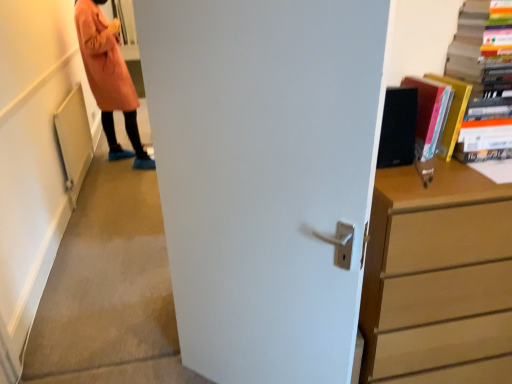
How much space does hardcover book at upper right, placed as the second book when sorted from left to right, occupy horizontally?

hardcover book at upper right, placed as the second book when sorted from left to right, is 29.87 centimeters wide.

The height and width of the screenshot is (384, 512). I want to click on wooden chest of drawers at right, so click(436, 271).

The image size is (512, 384). Describe the element at coordinates (452, 112) in the screenshot. I see `matte black book at upper right, placed as the second book when sorted from right to left` at that location.

This screenshot has width=512, height=384. Identify the location of hardcover book at upper right, placed as the second book when sorted from left to right. (440, 48).

Can you confirm if white matte door at center is positioned to the right of matte black book at upper right, placed as the second book when sorted from right to left?

In fact, white matte door at center is to the left of matte black book at upper right, placed as the second book when sorted from right to left.

Where is `the 1st book above when counting from the white matte door at center (from the image's perspective)`? The height and width of the screenshot is (384, 512). the 1st book above when counting from the white matte door at center (from the image's perspective) is located at coordinates (452, 112).

From a real-world perspective, is white matte door at center physically below matte black book at upper right, which is counted as the first book, starting from the left?

Result: Indeed, from a real-world perspective, white matte door at center is positioned beneath matte black book at upper right, which is counted as the first book, starting from the left.

From a real-world perspective, is hardcover book at upper right, which appears as the 1th book when viewed from the right, below white matte door at center?

No, from a real-world perspective, hardcover book at upper right, which appears as the 1th book when viewed from the right, is not beneath white matte door at center.

Locate an element on the screen. This screenshot has height=384, width=512. door on the left of hardcover book at upper right, placed as the second book when sorted from left to right is located at coordinates (265, 177).

Considering the sizes of objects hardcover book at upper right, placed as the second book when sorted from left to right, and white matte door at center in the image provided, who is smaller, hardcover book at upper right, placed as the second book when sorted from left to right, or white matte door at center?

hardcover book at upper right, placed as the second book when sorted from left to right, is smaller.

Is hardcover book at upper right, which appears as the 1th book when viewed from the right, located outside white matte door at center?

Absolutely, hardcover book at upper right, which appears as the 1th book when viewed from the right, is external to white matte door at center.

Can you confirm if matte black book at upper right, which is counted as the first book, starting from the left, is thinner than white matte door at center?

In fact, matte black book at upper right, which is counted as the first book, starting from the left, might be wider than white matte door at center.

Between point (460, 97) and point (251, 231), which one is positioned behind?

The point (460, 97) is farther from the camera.

From a real-world perspective, starting from the white matte door at center, which book is the 1st one vertically above it? Please provide its 2D coordinates.

[(452, 112)]

Looking at this image, would you say matte black book at upper right, which is counted as the first book, starting from the left, is inside or outside white matte door at center?

matte black book at upper right, which is counted as the first book, starting from the left, lies outside white matte door at center.

Do you think wooden chest of drawers at right is within hardcover book at upper right, placed as the second book when sorted from left to right, or outside of it?

wooden chest of drawers at right lies outside hardcover book at upper right, placed as the second book when sorted from left to right.

From the image's perspective, is wooden chest of drawers at right located above hardcover book at upper right, which appears as the 1th book when viewed from the right?

No, from the image's perspective, wooden chest of drawers at right is not on top of hardcover book at upper right, which appears as the 1th book when viewed from the right.

Considering the relative sizes of wooden chest of drawers at right and hardcover book at upper right, placed as the second book when sorted from left to right, in the image provided, is wooden chest of drawers at right bigger than hardcover book at upper right, placed as the second book when sorted from left to right,?

Correct, wooden chest of drawers at right is larger in size than hardcover book at upper right, placed as the second book when sorted from left to right.

Is wooden chest of drawers at right at the left side of hardcover book at upper right, placed as the second book when sorted from left to right?

Yes, wooden chest of drawers at right is to the left of hardcover book at upper right, placed as the second book when sorted from left to right.

Considering the positions of objects hardcover book at upper right, placed as the second book when sorted from left to right, and wooden chest of drawers at right in the image provided, who is more to the right, hardcover book at upper right, placed as the second book when sorted from left to right, or wooden chest of drawers at right?

From the viewer's perspective, hardcover book at upper right, placed as the second book when sorted from left to right, appears more on the right side.

From a real-world perspective, is hardcover book at upper right, placed as the second book when sorted from left to right, above or below wooden chest of drawers at right?

hardcover book at upper right, placed as the second book when sorted from left to right, is situated higher than wooden chest of drawers at right in the real world.

Is hardcover book at upper right, placed as the second book when sorted from left to right, not near wooden chest of drawers at right?

hardcover book at upper right, placed as the second book when sorted from left to right, is actually quite close to wooden chest of drawers at right.

From the image's perspective, which object appears higher, white matte door at center or hardcover book at upper right, placed as the second book when sorted from left to right?

From the image's view, hardcover book at upper right, placed as the second book when sorted from left to right, is above.

From the picture: Considering the sizes of objects white matte door at center and hardcover book at upper right, which appears as the 1th book when viewed from the right, in the image provided, who is wider, white matte door at center or hardcover book at upper right, which appears as the 1th book when viewed from the right,?

hardcover book at upper right, which appears as the 1th book when viewed from the right.

Can you confirm if white matte door at center is taller than hardcover book at upper right, which appears as the 1th book when viewed from the right?

Yes, white matte door at center is taller than hardcover book at upper right, which appears as the 1th book when viewed from the right.

Between white matte door at center and hardcover book at upper right, which appears as the 1th book when viewed from the right, which one is positioned in front?

white matte door at center.

Are matte black book at upper right, which is counted as the first book, starting from the left, and hardcover book at upper right, placed as the second book when sorted from left to right, far apart?

No, matte black book at upper right, which is counted as the first book, starting from the left, is in close proximity to hardcover book at upper right, placed as the second book when sorted from left to right.

Does matte black book at upper right, placed as the second book when sorted from right to left, have a lesser width compared to hardcover book at upper right, placed as the second book when sorted from left to right?

Yes, matte black book at upper right, placed as the second book when sorted from right to left, is thinner than hardcover book at upper right, placed as the second book when sorted from left to right.

Identify the location of book above the matte black book at upper right, which is counted as the first book, starting from the left (from a real-world perspective). Image resolution: width=512 pixels, height=384 pixels. (440, 48).

Find the location of `the 1st book above the white matte door at center (from the image's perspective)`. the 1st book above the white matte door at center (from the image's perspective) is located at coordinates (452, 112).

Which book is the 2nd one when counting from the right side of the white matte door at center? Please provide its 2D coordinates.

[(440, 48)]

Consider the image. Which object lies further to the anchor point hardcover book at upper right, placed as the second book when sorted from left to right, white matte door at center or matte black book at upper right, which is counted as the first book, starting from the left?

Among the two, white matte door at center is located further to hardcover book at upper right, placed as the second book when sorted from left to right.

Estimate the real-world distances between objects in this image. Which object is closer to hardcover book at upper right, which appears as the 1th book when viewed from the right, matte black book at upper right, placed as the second book when sorted from right to left, or white matte door at center?

Based on the image, matte black book at upper right, placed as the second book when sorted from right to left, appears to be nearer to hardcover book at upper right, which appears as the 1th book when viewed from the right.

When comparing their distances from wooden chest of drawers at right, does white matte door at center or hardcover book at upper right, placed as the second book when sorted from left to right, seem closer?

Among the two, white matte door at center is located nearer to wooden chest of drawers at right.

Which object lies nearer to the anchor point wooden chest of drawers at right, white matte door at center or matte black book at upper right, which is counted as the first book, starting from the left?

Among the two, white matte door at center is located nearer to wooden chest of drawers at right.

Looking at the image, which one is located further to wooden chest of drawers at right, matte black book at upper right, placed as the second book when sorted from right to left, or hardcover book at upper right, placed as the second book when sorted from left to right?

Based on the image, matte black book at upper right, placed as the second book when sorted from right to left, appears to be further to wooden chest of drawers at right.

Considering their positions, is matte black book at upper right, which is counted as the first book, starting from the left, positioned further to hardcover book at upper right, which appears as the 1th book when viewed from the right, than wooden chest of drawers at right?

Among the two, wooden chest of drawers at right is located further to hardcover book at upper right, which appears as the 1th book when viewed from the right.

Based on their spatial positions, is matte black book at upper right, which is counted as the first book, starting from the left, or white matte door at center closer to wooden chest of drawers at right?

Based on the image, white matte door at center appears to be nearer to wooden chest of drawers at right.

Which object lies nearer to the anchor point white matte door at center, hardcover book at upper right, which appears as the 1th book when viewed from the right, or matte black book at upper right, placed as the second book when sorted from right to left?

matte black book at upper right, placed as the second book when sorted from right to left.

Where is `book between white matte door at center and hardcover book at upper right, placed as the second book when sorted from left to right, from left to right`? This screenshot has width=512, height=384. book between white matte door at center and hardcover book at upper right, placed as the second book when sorted from left to right, from left to right is located at coordinates (452, 112).

Find the location of a particular element. This screenshot has width=512, height=384. the chest of drawers situated between white matte door at center and hardcover book at upper right, which appears as the 1th book when viewed from the right, from left to right is located at coordinates (436, 271).

Locate an element on the screen. book between hardcover book at upper right, placed as the second book when sorted from left to right, and wooden chest of drawers at right from top to bottom is located at coordinates (452, 112).

Find the location of a particular element. The image size is (512, 384). book between white matte door at center and wooden chest of drawers at right in the horizontal direction is located at coordinates tap(452, 112).